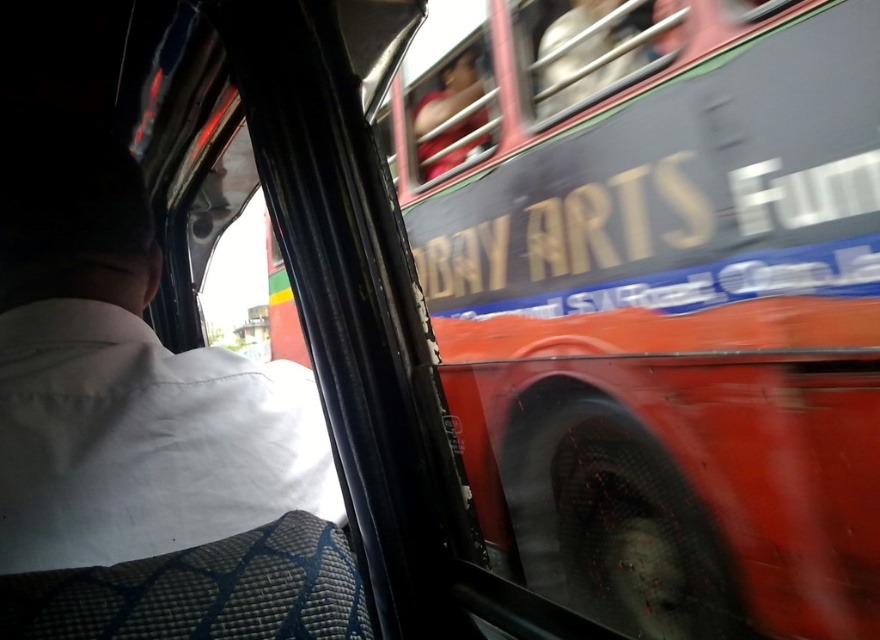
Can you confirm if red matte bus at upper right is bigger than white fabric shirt at left?

Yes, red matte bus at upper right is bigger than white fabric shirt at left.

Does point (673, 161) come behind point (304, 445)?

Yes, it is.

You are a GUI agent. You are given a task and a screenshot of the screen. Output one action in this format:
    pyautogui.click(x=<x>, y=<y>)
    Task: Click on the red matte bus at upper right
    The image size is (880, 640).
    Given the screenshot: What is the action you would take?
    pyautogui.click(x=660, y=301)

Can you confirm if white fabric shirt at left is bigger than metallic red bus window at upper center?

Actually, white fabric shirt at left might be smaller than metallic red bus window at upper center.

Between point (32, 252) and point (419, 38), which one is positioned behind?

The point (419, 38) is behind.

Is point (226, 420) closer to viewer compared to point (431, 179)?

Yes.

Where is `white fabric shirt at left`? The width and height of the screenshot is (880, 640). white fabric shirt at left is located at coordinates (125, 381).

In the scene shown: Is red matte bus at upper right above metallic red bus window at upper center?

Incorrect, red matte bus at upper right is not positioned above metallic red bus window at upper center.

Is point (504, 356) positioned before point (496, 136)?

Yes, point (504, 356) is in front of point (496, 136).

This screenshot has height=640, width=880. Find the location of `red matte bus at upper right`. red matte bus at upper right is located at coordinates (660, 301).